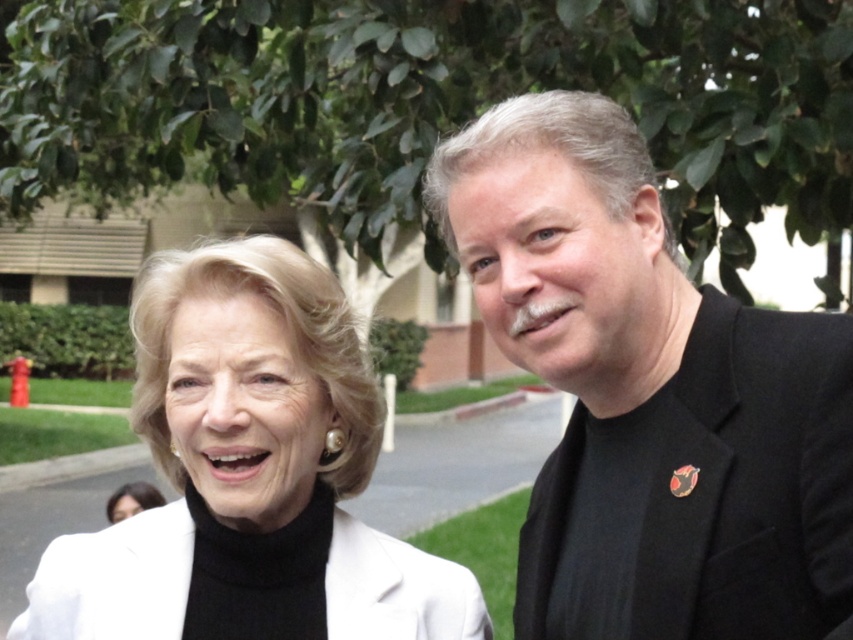
Question: Is white matte jacket at upper left further to camera compared to white matte blazer at lower left?

Choices:
 (A) no
 (B) yes

Answer: (A)

Question: Is black matte suit at right bigger than white matte blazer at lower left?

Choices:
 (A) no
 (B) yes

Answer: (B)

Question: Estimate the real-world distances between objects in this image. Which object is farther from the white matte blazer at lower left?

Choices:
 (A) white matte jacket at upper left
 (B) black matte suit at right

Answer: (B)

Question: Which of the following is the farthest from the observer?

Choices:
 (A) white matte jacket at upper left
 (B) black matte suit at right

Answer: (A)

Question: Which point appears closest to the camera in this image?

Choices:
 (A) (212, 550)
 (B) (787, 525)

Answer: (B)

Question: Does white matte jacket at upper left come in front of white matte blazer at lower left?

Choices:
 (A) no
 (B) yes

Answer: (B)